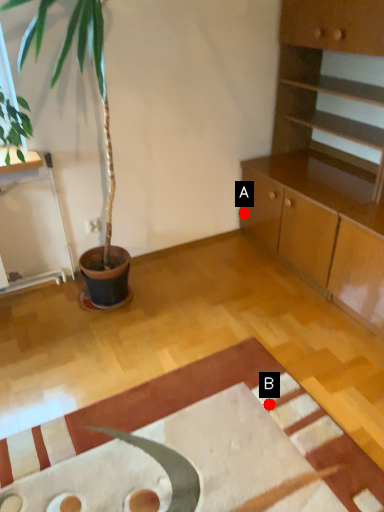
Question: Two points are circled on the image, labeled by A and B beside each circle. Which point is farther from the camera taking this photo?

Choices:
 (A) A is further
 (B) B is further

Answer: (A)